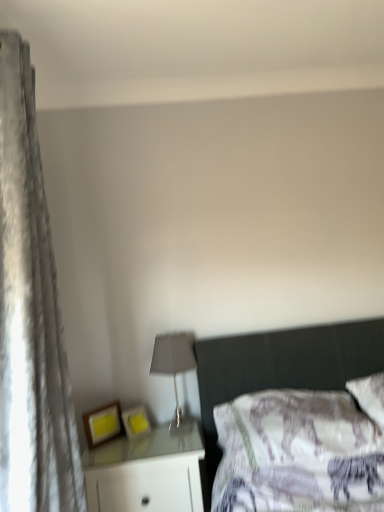
You are a GUI agent. You are given a task and a screenshot of the screen. Output one action in this format:
    pyautogui.click(x=<x>, y=<y>)
    Task: Click on the vacant space positioned to the left of matte gray lampshade at center
    
    Given the screenshot: What is the action you would take?
    pyautogui.click(x=138, y=440)